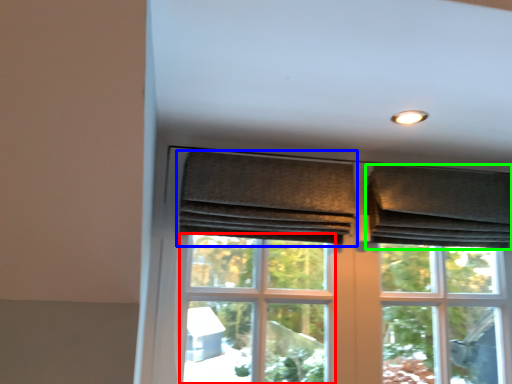
Question: Which object is positioned farthest from screen door (highlighted by a red box)? Select from curtain (highlighted by a blue box) and curtain (highlighted by a green box).

Choices:
 (A) curtain
 (B) curtain

Answer: (B)